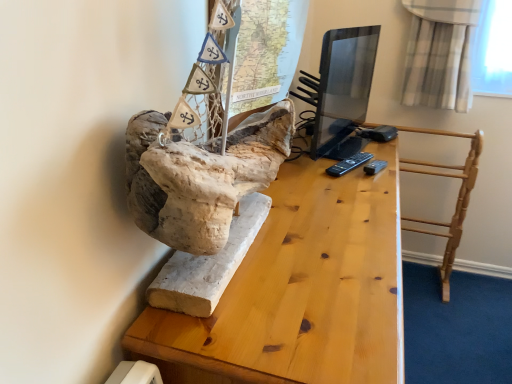
Locate an element on the screen. natural wood table at center is located at coordinates (300, 290).

Image resolution: width=512 pixels, height=384 pixels. In order to click on matte black monitor at center in this screenshot , I will do `click(343, 85)`.

You are a GUI agent. You are given a task and a screenshot of the screen. Output one action in this format:
    pyautogui.click(x=<x>, y=<y>)
    Task: Click on the natural wood table at center
    The image size is (512, 384).
    Given the screenshot: What is the action you would take?
    pyautogui.click(x=300, y=290)

Is matte black monitor at center with natural wood table at center?

matte black monitor at center is not next to natural wood table at center, and they're not touching.

Considering the positions of objects matte black monitor at center and natural wood table at center in the image provided, who is more to the right, matte black monitor at center or natural wood table at center?

Positioned to the right is matte black monitor at center.

Consider the image. In terms of height, does matte black monitor at center look taller or shorter compared to natural wood table at center?

matte black monitor at center is shorter than natural wood table at center.

Do you think matte black monitor at center is within natural wood table at center, or outside of it?

The correct answer is: outside.

Where is `table that appears below the matte black monitor at center (from the image's perspective)`? The width and height of the screenshot is (512, 384). table that appears below the matte black monitor at center (from the image's perspective) is located at coordinates (300, 290).

Is natural wood table at center facing towards matte black monitor at center?

No.

In the scene shown: Which object is positioned more to the right, natural wood table at center or matte black monitor at center?

Positioned to the right is matte black monitor at center.

Is matte black monitor at center outside of light wood/rough table at center?

Yes.

Consider the image. How different are the orientations of matte black monitor at center and light wood/rough table at center in degrees?

77.9 degrees.

Can you confirm if matte black monitor at center is shorter than light wood/rough table at center?

Yes.

From the image's perspective, is natural wood table at center over light wood/rough table at center?

No, from the image's perspective, natural wood table at center is not above light wood/rough table at center.

Looking at this image, is natural wood table at center turned away from light wood/rough table at center?

No, natural wood table at center is not facing away from light wood/rough table at center.

Is natural wood table at center in contact with light wood/rough table at center?

They are not placed beside each other.

Which is behind, point (372, 334) or point (402, 170)?

The point (402, 170) is farther from the camera.

Can you confirm if light wood/rough table at center is taller than natural wood table at center?

No, light wood/rough table at center is not taller than natural wood table at center.

Who is smaller, light wood/rough table at center or natural wood table at center?

Smaller between the two is light wood/rough table at center.

Is light wood/rough table at center positioned with its back to natural wood table at center?

No, natural wood table at center is not at the back of light wood/rough table at center.

From a real-world perspective, is light wood/rough table at center positioned above or below natural wood table at center?

light wood/rough table at center is above natural wood table at center.

In the scene shown: Could you tell me if light wood/rough table at center is turned towards matte black monitor at center?

No, light wood/rough table at center is not oriented towards matte black monitor at center.

How different are the orientations of light wood/rough table at center and matte black monitor at center in degrees?

The angular difference between light wood/rough table at center and matte black monitor at center is 77.9 degrees.

Is light wood/rough table at center smaller than matte black monitor at center?

Actually, light wood/rough table at center might be larger than matte black monitor at center.

There is a natural wood table at center. Where is `computer monitor above it (from a real-world perspective)`? This screenshot has height=384, width=512. computer monitor above it (from a real-world perspective) is located at coordinates (343, 85).

The width and height of the screenshot is (512, 384). Find the location of `table below the matte black monitor at center (from the image's perspective)`. table below the matte black monitor at center (from the image's perspective) is located at coordinates (300, 290).

Considering their positions, is matte black monitor at center positioned further to natural wood table at center than light wood/rough table at center?

matte black monitor at center.

Considering their positions, is natural wood table at center positioned further to light wood/rough table at center than matte black monitor at center?

Based on the image, natural wood table at center appears to be further to light wood/rough table at center.

Which object lies nearer to the anchor point matte black monitor at center, natural wood table at center or light wood/rough table at center?

light wood/rough table at center is positioned closer to the anchor matte black monitor at center.

Looking at the image, which one is located closer to light wood/rough table at center, matte black monitor at center or natural wood table at center?

Among the two, matte black monitor at center is located nearer to light wood/rough table at center.

Based on their spatial positions, is light wood/rough table at center or matte black monitor at center closer to natural wood table at center?

light wood/rough table at center.

Which object lies further to the anchor point matte black monitor at center, light wood/rough table at center or natural wood table at center?

natural wood table at center is further to matte black monitor at center.

What are the coordinates of `computer monitor positioned between natural wood table at center and light wood/rough table at center from near to far` in the screenshot? It's located at (343, 85).